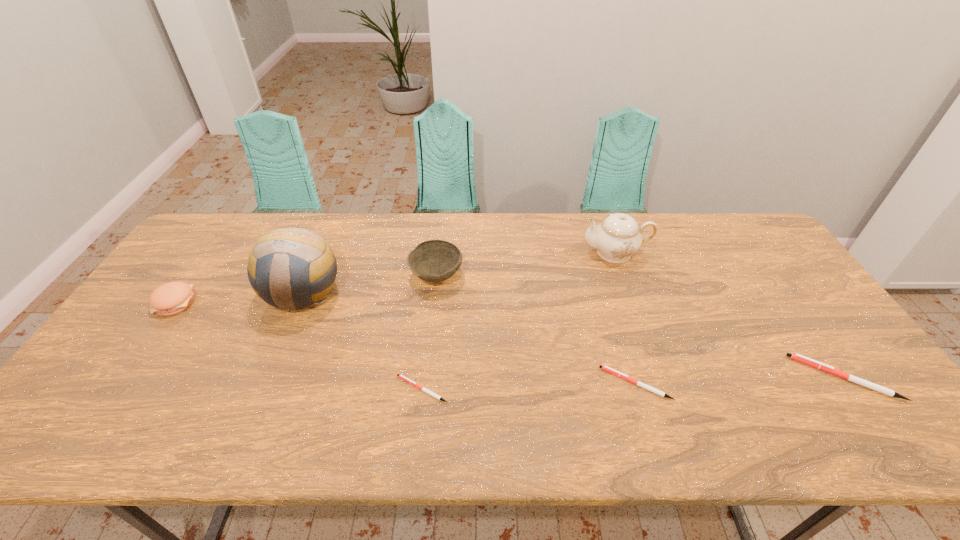
Please point a free position for a pen on the left. Please provide its 2D coordinates. Your answer should be formatted as a tuple, i.e. [(x, y)], where the tuple contains the x and y coordinates of a point satisfying the conditions above.

[(204, 395)]